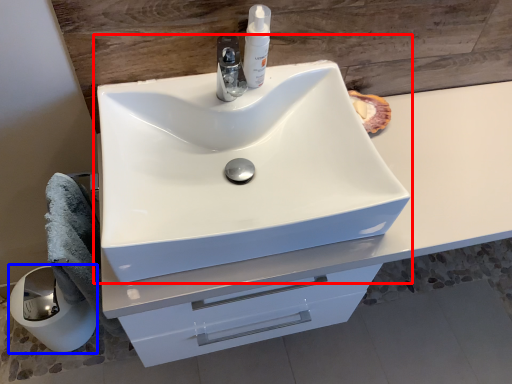
Question: Which point is further to the camera, sink (highlighted by a red box) or paper towel (highlighted by a blue box)?

Choices:
 (A) sink
 (B) paper towel

Answer: (B)